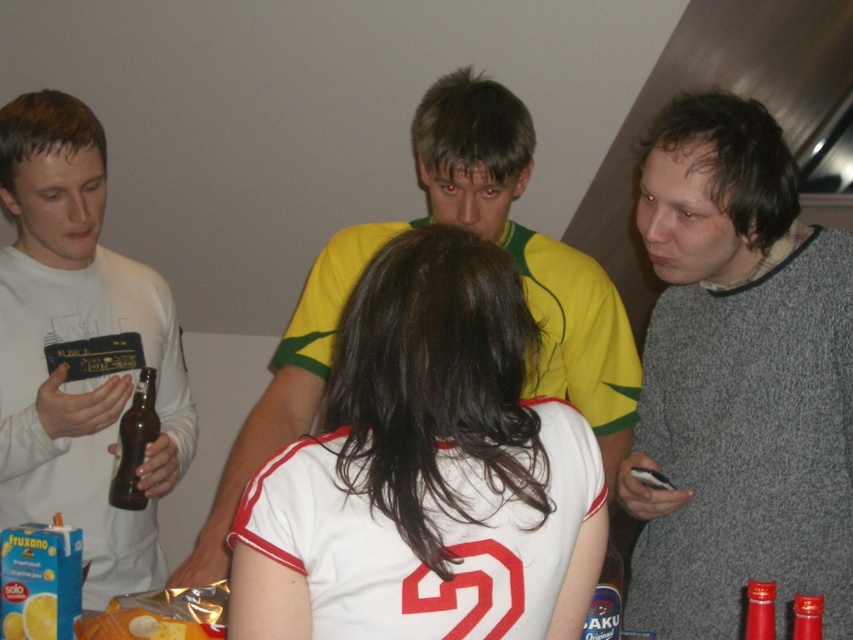
Looking at the scene, which object is positioned to the left between the translucent plastic bottle at lower right and the red glass bottle at lower right?

The translucent plastic bottle at lower right is positioned to the left of the red glass bottle at lower right.

You are at a party and want to grab the red glass bottle at lower right to get a drink. However, the yellow matte lemon at lower left is blocking your path. Can you reach the bottle without moving the lemon?

The red glass bottle at lower right is behind the yellow matte lemon at lower left, so you can reach the bottle by moving around the lemon or bending down, but you cannot directly access it without moving the lemon since it is blocking the path.